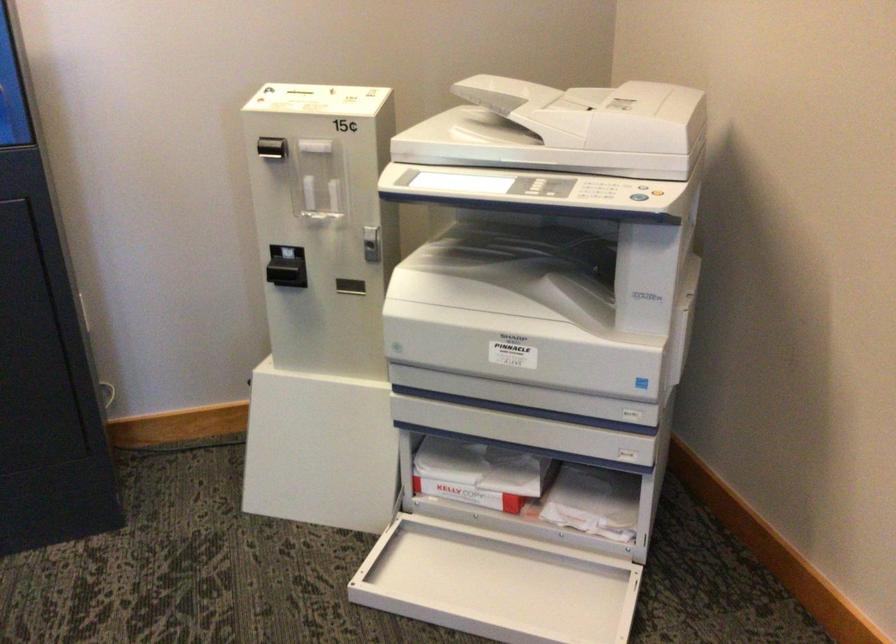
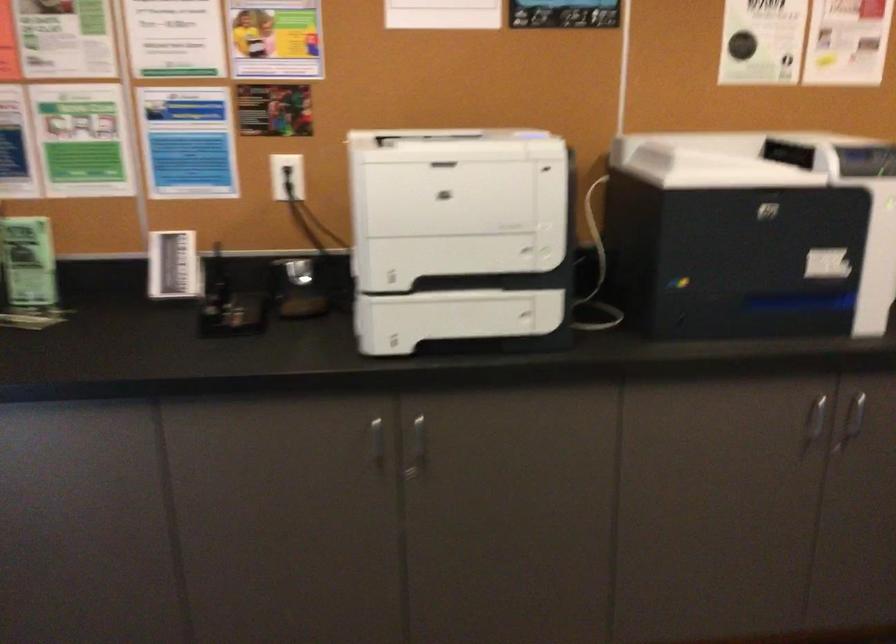
Based on the continuous images, in which direction is the camera rotating?

The camera rotated toward left-down.